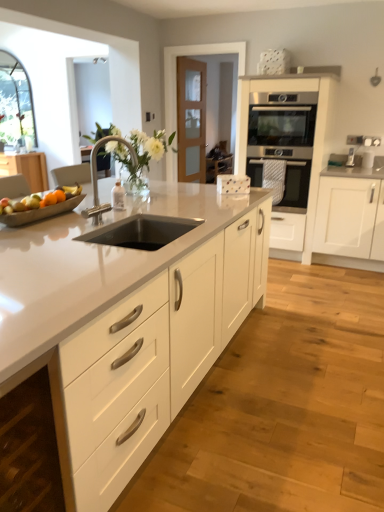
What are the coordinates of `free region on the left part of silver metallic faucet at center` in the screenshot? It's located at (70, 223).